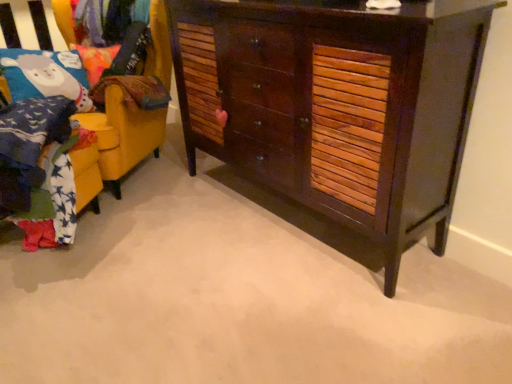
Image resolution: width=512 pixels, height=384 pixels. What do you see at coordinates (337, 105) in the screenshot?
I see `dark wood cabinet at center` at bounding box center [337, 105].

In order to click on velvet fabric pillow at upper left in this screenshot , I will do `click(108, 19)`.

Can you confirm if dark wood cabinet at center is wider than yellow fabric chair at left?

In fact, dark wood cabinet at center might be narrower than yellow fabric chair at left.

Considering their positions, is dark wood cabinet at center located in front of or behind yellow fabric chair at left?

dark wood cabinet at center is positioned closer to the viewer than yellow fabric chair at left.

Considering the points (326, 117) and (128, 156), which point is behind, point (326, 117) or point (128, 156)?

The point (128, 156) is behind.

From the image's perspective, does dark wood cabinet at center appear lower than yellow fabric chair at left?

Indeed, from the image's perspective, dark wood cabinet at center is shown beneath yellow fabric chair at left.

Is yellow fabric chair at left at the back of velvet fabric pillow at upper left?

That's right, velvet fabric pillow at upper left is facing away from yellow fabric chair at left.

In the scene shown: From the image's perspective, is velvet fabric pillow at upper left beneath yellow fabric chair at left?

Actually, velvet fabric pillow at upper left appears above yellow fabric chair at left in the image.

Are velvet fabric pillow at upper left and yellow fabric chair at left beside each other?

No.

From a real-world perspective, is dark wood cabinet at center physically above velvet fabric pillow at upper left?

Actually, dark wood cabinet at center is physically below velvet fabric pillow at upper left in the real world.

Based on their positions, is dark wood cabinet at center located to the left or right of velvet fabric pillow at upper left?

Clearly, dark wood cabinet at center is on the right of velvet fabric pillow at upper left in the image.

From their relative heights in the image, would you say dark wood cabinet at center is taller or shorter than velvet fabric pillow at upper left?

Clearly, dark wood cabinet at center is taller compared to velvet fabric pillow at upper left.

From the image's perspective, would you say dark wood cabinet at center is shown under velvet fabric pillow at upper left?

Yes, from the image's perspective, dark wood cabinet at center is below velvet fabric pillow at upper left.

Looking at their sizes, would you say velvet fabric pillow at upper left is wider or thinner than dark wood cabinet at center?

Considering their sizes, velvet fabric pillow at upper left looks slimmer than dark wood cabinet at center.

Looking at this image, which is closer, (x=98, y=5) or (x=474, y=59)?

The point (x=474, y=59) is in front.

Is velvet fabric pillow at upper left oriented away from dark wood cabinet at center?

No, velvet fabric pillow at upper left's orientation is not away from dark wood cabinet at center.

Is yellow fabric chair at left oriented towards dark wood cabinet at center?

No.

Which is more to the left, yellow fabric chair at left or dark wood cabinet at center?

yellow fabric chair at left.

Considering the sizes of objects yellow fabric chair at left and dark wood cabinet at center in the image provided, who is bigger, yellow fabric chair at left or dark wood cabinet at center?

With larger size is yellow fabric chair at left.

Considering the positions of objects yellow fabric chair at left and dark wood cabinet at center in the image provided, who is in front, yellow fabric chair at left or dark wood cabinet at center?

dark wood cabinet at center is more forward.

Are yellow fabric chair at left and velvet fabric pillow at upper left far apart?

That's not correct — yellow fabric chair at left is a little close to velvet fabric pillow at upper left.

Considering the sizes of yellow fabric chair at left and velvet fabric pillow at upper left in the image, is yellow fabric chair at left bigger or smaller than velvet fabric pillow at upper left?

Clearly, yellow fabric chair at left is larger in size than velvet fabric pillow at upper left.

Considering the relative positions of yellow fabric chair at left and velvet fabric pillow at upper left in the image provided, is yellow fabric chair at left to the right of velvet fabric pillow at upper left from the viewer's perspective?

No, yellow fabric chair at left is not to the right of velvet fabric pillow at upper left.

Locate an element on the screen. This screenshot has height=384, width=512. furniture behind the dark wood cabinet at center is located at coordinates (126, 137).

Identify the location of furniture below the velvet fabric pillow at upper left (from the image's perspective). (126, 137).

Considering their positions, is yellow fabric chair at left positioned closer to dark wood cabinet at center than velvet fabric pillow at upper left?

yellow fabric chair at left is positioned closer to the anchor dark wood cabinet at center.

When comparing their distances from yellow fabric chair at left, does dark wood cabinet at center or velvet fabric pillow at upper left seem closer?

velvet fabric pillow at upper left.

Which object lies further to the anchor point dark wood cabinet at center, velvet fabric pillow at upper left or yellow fabric chair at left?

velvet fabric pillow at upper left.

Based on their spatial positions, is dark wood cabinet at center or yellow fabric chair at left closer to velvet fabric pillow at upper left?

yellow fabric chair at left.

Which object lies nearer to the anchor point yellow fabric chair at left, velvet fabric pillow at upper left or dark wood cabinet at center?

The object closer to yellow fabric chair at left is velvet fabric pillow at upper left.

Based on their spatial positions, is yellow fabric chair at left or dark wood cabinet at center further from velvet fabric pillow at upper left?

The object further to velvet fabric pillow at upper left is dark wood cabinet at center.

You are a GUI agent. You are given a task and a screenshot of the screen. Output one action in this format:
    pyautogui.click(x=<x>, y=<y>)
    Task: Click on the furniture between dark wood cabinet at center and velvet fabric pillow at upper left from front to back
    The height and width of the screenshot is (384, 512).
    Given the screenshot: What is the action you would take?
    click(x=126, y=137)